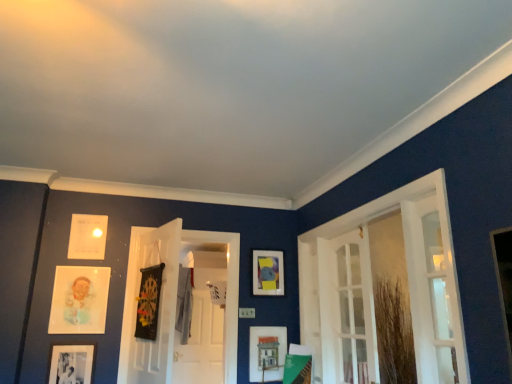
Identify the location of white glass door at right, which is the third door in left-to-right order. (433, 292).

What do you see at coordinates (372, 285) in the screenshot? This screenshot has width=512, height=384. I see `white glass door at right` at bounding box center [372, 285].

At what (x,y) coordinates should I click in order to perform the action: click on white glass door at right, which is the third door in left-to-right order. Please return your answer as a coordinate pair (x, y). Looking at the image, I should click on (433, 292).

From a real-world perspective, is black glossy dartboard at center, which is the 3th door in right-to-left order, positioned above or below white glass door at right, the second door when ordered from right to left?

From a real-world perspective, black glossy dartboard at center, which is the 3th door in right-to-left order, is physically above white glass door at right, the second door when ordered from right to left.

In the scene shown: In the image, is black glossy dartboard at center, which is the 3th door in right-to-left order, on the left side or the right side of white glass door at right, the second door when ordered from right to left?

black glossy dartboard at center, which is the 3th door in right-to-left order, is to the left of white glass door at right, the second door when ordered from right to left.

Is black glossy dartboard at center, which is the 3th door in right-to-left order, shorter than white glass door at right, the second door when ordered from right to left?

Incorrect, the height of black glossy dartboard at center, which is the 3th door in right-to-left order, does not fall short of that of white glass door at right, the second door when ordered from right to left.

From the image's perspective, is white paper at upper left, the 3th picture frame when ordered from left to right, positioned above or below white glass door at right, the 2th door from the left?

white paper at upper left, the 3th picture frame when ordered from left to right, is situated higher than white glass door at right, the 2th door from the left, in the image.

Does white paper at upper left, the 3th picture frame when ordered from left to right, have a lesser width compared to white glass door at right, the 2th door from the left?

Indeed, white paper at upper left, the 3th picture frame when ordered from left to right, has a lesser width compared to white glass door at right, the 2th door from the left.

Is white paper at upper left, the 3th picture frame when ordered from left to right, at the right side of white glass door at right, the second door when ordered from right to left?

Incorrect, white paper at upper left, the 3th picture frame when ordered from left to right, is not on the right side of white glass door at right, the second door when ordered from right to left.

Locate an element on the screen. The image size is (512, 384). the 4th picture frame above the white glass door at right, the 2th door from the left (from a real-world perspective) is located at coordinates (87, 237).

Considering the relative sizes of white glossy door at center and white glass door at right, the 2th door from the left, in the image provided, is white glossy door at center bigger than white glass door at right, the 2th door from the left,?

Incorrect, white glossy door at center is not larger than white glass door at right, the 2th door from the left.

Considering the sizes of objects white glossy door at center and white glass door at right, the 2th door from the left, in the image provided, who is taller, white glossy door at center or white glass door at right, the 2th door from the left,?

With more height is white glossy door at center.

Is white glossy door at center positioned with its back to white glass door at right, the second door when ordered from right to left?

No, white glossy door at center is not facing the opposite direction of white glass door at right, the second door when ordered from right to left.

Looking at this image, is white glossy door at center not close to white glass door at right, the 2th door from the left?

Yes, white glossy door at center is far from white glass door at right, the 2th door from the left.

Would you say black glossy dartboard at center, which is the first door in left-to-right order, is part of matte paper portrait at left, the second picture frame viewed from the left,'s contents?

Definitely not — black glossy dartboard at center, which is the first door in left-to-right order, is not inside matte paper portrait at left, the second picture frame viewed from the left.

Can you tell me how much matte paper portrait at left, which is the 5th picture frame from right to left, and black glossy dartboard at center, which is the 3th door in right-to-left order, differ in facing direction?

The facing directions of matte paper portrait at left, which is the 5th picture frame from right to left, and black glossy dartboard at center, which is the 3th door in right-to-left order, are 73.5 degrees apart.

From the image's perspective, between matte paper portrait at left, which is the 5th picture frame from right to left, and black glossy dartboard at center, which is the first door in left-to-right order, which one is located above?

black glossy dartboard at center, which is the first door in left-to-right order, appears higher in the image.

Consider the image. Considering the relative positions of white paper at upper left, the 4th picture frame in the right-to-left sequence, and white glossy door at center in the image provided, is white paper at upper left, the 4th picture frame in the right-to-left sequence, in front of white glossy door at center?

Yes, it is in front of white glossy door at center.

Looking at this image, how far apart are white paper at upper left, the 4th picture frame in the right-to-left sequence, and white glossy door at center?

A distance of 6.99 feet exists between white paper at upper left, the 4th picture frame in the right-to-left sequence, and white glossy door at center.

Looking at the image, does white paper at upper left, the 4th picture frame in the right-to-left sequence, seem bigger or smaller compared to white glossy door at center?

Clearly, white paper at upper left, the 4th picture frame in the right-to-left sequence, is smaller in size than white glossy door at center.

Would you say white paper at upper left, the 4th picture frame in the right-to-left sequence, is outside white glossy door at center?

white paper at upper left, the 4th picture frame in the right-to-left sequence, is positioned outside white glossy door at center.

Considering the positions of objects matte black picture frame at lower left, placed as the 1th picture frame when sorted from left to right, and black glossy dartboard at center, which is the first door in left-to-right order, in the image provided, who is more to the right, matte black picture frame at lower left, placed as the 1th picture frame when sorted from left to right, or black glossy dartboard at center, which is the first door in left-to-right order,?

Positioned to the right is black glossy dartboard at center, which is the first door in left-to-right order.

Considering the positions of objects matte black picture frame at lower left, placed as the 1th picture frame when sorted from left to right, and black glossy dartboard at center, which is the 3th door in right-to-left order, in the image provided, who is behind, matte black picture frame at lower left, placed as the 1th picture frame when sorted from left to right, or black glossy dartboard at center, which is the 3th door in right-to-left order,?

matte black picture frame at lower left, placed as the 1th picture frame when sorted from left to right, is further away from the camera.

From a real-world perspective, which object stands above the other?

In real-world perspective, black glossy dartboard at center, which is the 3th door in right-to-left order, is above.

Is matte black picture frame at lower left, which is counted as the 6th picture frame, starting from the right, taller or shorter than black glossy dartboard at center, which is the first door in left-to-right order?

Considering their sizes, matte black picture frame at lower left, which is counted as the 6th picture frame, starting from the right, has less height than black glossy dartboard at center, which is the first door in left-to-right order.

At what (x,y) coordinates should I click in order to perform the action: click on the 6th picture frame to the left of the white glass door at right, the 2th door from the left, counting from the anchor's position. Please return your answer as a coordinate pair (x, y). Looking at the image, I should click on (71, 364).

From a real-world perspective, between matte black picture frame at lower left, which is counted as the 6th picture frame, starting from the right, and white glass door at right, the 2th door from the left, who is vertically higher?

white glass door at right, the 2th door from the left, from a real-world perspective.

Between matte black picture frame at lower left, placed as the 1th picture frame when sorted from left to right, and white glass door at right, the 2th door from the left, which one has larger size?

Bigger between the two is white glass door at right, the 2th door from the left.

Considering the relative positions of matte black picture frame at lower left, placed as the 1th picture frame when sorted from left to right, and white glass door at right, the second door when ordered from right to left, in the image provided, is matte black picture frame at lower left, placed as the 1th picture frame when sorted from left to right, to the right of white glass door at right, the second door when ordered from right to left, from the viewer's perspective?

In fact, matte black picture frame at lower left, placed as the 1th picture frame when sorted from left to right, is to the left of white glass door at right, the second door when ordered from right to left.

Where is `the 1st door counting from the right side of the black glossy dartboard at center, which is the 3th door in right-to-left order`? Image resolution: width=512 pixels, height=384 pixels. the 1st door counting from the right side of the black glossy dartboard at center, which is the 3th door in right-to-left order is located at coordinates (346, 310).

Where is `the 4th picture frame counting from the left of the white glass door at right, the second door when ordered from right to left`? The height and width of the screenshot is (384, 512). the 4th picture frame counting from the left of the white glass door at right, the second door when ordered from right to left is located at coordinates (87, 237).

Estimate the real-world distances between objects in this image. Which object is closer to matte plastic picture frame at center, arranged as the fifth picture frame when viewed from the left, white glossy door at center or matte black picture frame at lower left, which is counted as the 6th picture frame, starting from the right?

Among the two, matte black picture frame at lower left, which is counted as the 6th picture frame, starting from the right, is located nearer to matte plastic picture frame at center, arranged as the fifth picture frame when viewed from the left.

When comparing their distances from white glass door at right, which appears as the first door when viewed from the right, does matte black picture frame at lower left, placed as the 1th picture frame when sorted from left to right, or black glossy dartboard at center, which is the 3th door in right-to-left order, seem further?

matte black picture frame at lower left, placed as the 1th picture frame when sorted from left to right, is positioned further to the anchor white glass door at right, which appears as the first door when viewed from the right.

Considering their positions, is matte plastic picture frame at center, marked as the 2th picture frame in a right-to-left arrangement, positioned further to white glass door at right, the 2th door from the left, than white paper at upper left, the 4th picture frame in the right-to-left sequence?

Among the two, white paper at upper left, the 4th picture frame in the right-to-left sequence, is located further to white glass door at right, the 2th door from the left.

Based on their spatial positions, is white glass door at right or matte black picture frame at lower left, which is counted as the 6th picture frame, starting from the right, further from matte paper portrait at left, the second picture frame viewed from the left?

white glass door at right lies further to matte paper portrait at left, the second picture frame viewed from the left, than the other object.

From the image, which object appears to be farther from black matte dartboard at center, the third picture frame viewed from the right, matte wooden picture frame at lower center, arranged as the sixth picture frame when viewed from the left, or black glossy dartboard at center, which is the first door in left-to-right order?

Based on the image, matte wooden picture frame at lower center, arranged as the sixth picture frame when viewed from the left, appears to be further to black matte dartboard at center, the third picture frame viewed from the right.

When comparing their distances from matte paper portrait at left, the second picture frame viewed from the left, does matte wooden picture frame at lower center, arranged as the sixth picture frame when viewed from the left, or matte plastic picture frame at center, arranged as the fifth picture frame when viewed from the left, seem closer?

Among the two, matte wooden picture frame at lower center, arranged as the sixth picture frame when viewed from the left, is located nearer to matte paper portrait at left, the second picture frame viewed from the left.

Looking at this image, considering their positions, is white glass door at right, which is the third door in left-to-right order, positioned closer to white glass door at right than black matte dartboard at center, the third picture frame viewed from the right?

white glass door at right, which is the third door in left-to-right order, is positioned closer to the anchor white glass door at right.

Estimate the real-world distances between objects in this image. Which object is closer to black glossy dartboard at center, which is the 3th door in right-to-left order, white glass door at right or white glass door at right, which is the third door in left-to-right order?

white glass door at right is closer to black glossy dartboard at center, which is the 3th door in right-to-left order.

The height and width of the screenshot is (384, 512). In order to click on door between black matte dartboard at center, the third picture frame viewed from the right, and matte wooden picture frame at lower center, arranged as the sixth picture frame when viewed from the left in this screenshot , I will do `click(159, 303)`.

You are a GUI agent. You are given a task and a screenshot of the screen. Output one action in this format:
    pyautogui.click(x=<x>, y=<y>)
    Task: Click on the door between matte black picture frame at lower left, which is counted as the 6th picture frame, starting from the right, and white glass door at right, the 2th door from the left
    This screenshot has height=384, width=512.
    Given the screenshot: What is the action you would take?
    pyautogui.click(x=159, y=303)

You are a GUI agent. You are given a task and a screenshot of the screen. Output one action in this format:
    pyautogui.click(x=<x>, y=<y>)
    Task: Click on the door between black glossy dartboard at center, which is the 3th door in right-to-left order, and white glass door at right
    
    Given the screenshot: What is the action you would take?
    pyautogui.click(x=346, y=310)

Identify the location of window between matte paper portrait at left, the second picture frame viewed from the left, and white glass door at right, which is the third door in left-to-right order, from left to right. Image resolution: width=512 pixels, height=384 pixels. (372, 285).